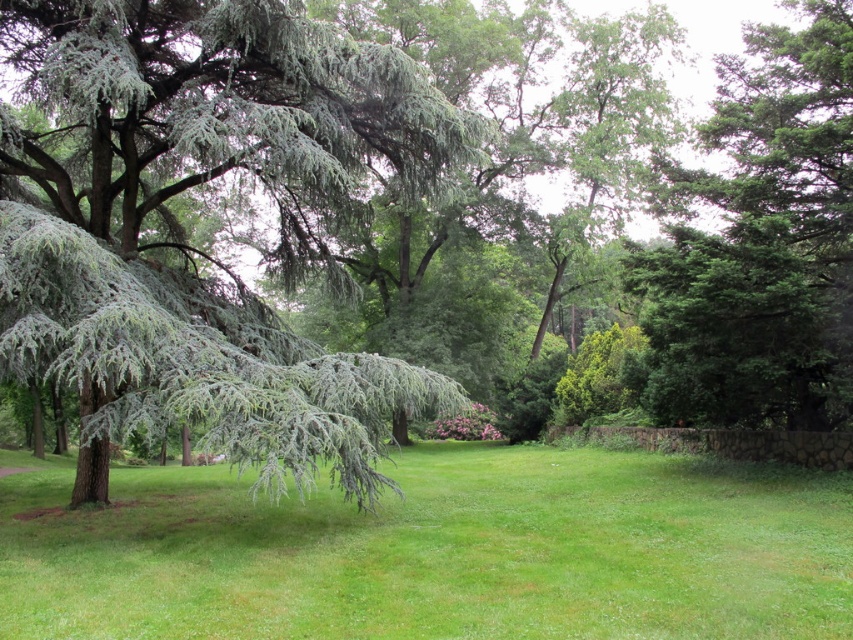
Between green grass at center and green leafy tree at upper right, which one appears on the right side from the viewer's perspective?

Positioned to the right is green leafy tree at upper right.

Is point (567, 484) less distant than point (653, 394)?

That is True.

Where is `green grass at center`? green grass at center is located at coordinates (437, 552).

Which is below, green needle-like at left or green leafy tree at upper right?

green needle-like at left

Does green needle-like at left have a lesser height compared to green leafy tree at upper right?

Yes.

Between point (27, 362) and point (705, 250), which one is positioned in front?

Positioned in front is point (27, 362).

This screenshot has width=853, height=640. I want to click on green needle-like at left, so click(190, 244).

Consider the image. Is green needle-like at left positioned before green grass at center?

No, it is not.

Is green needle-like at left wider than green grass at center?

No, green needle-like at left is not wider than green grass at center.

This screenshot has height=640, width=853. Describe the element at coordinates (190, 244) in the screenshot. I see `green needle-like at left` at that location.

Where is `green needle-like at left`? This screenshot has width=853, height=640. green needle-like at left is located at coordinates (190, 244).